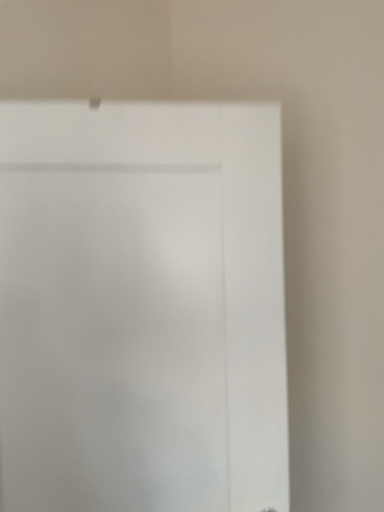
The height and width of the screenshot is (512, 384). What are the coordinates of `white matte door at center` in the screenshot? It's located at (142, 308).

In order to face white matte door at center, should I rotate leftwards or rightwards?

A 6.688 degree turn to the left will do.

The image size is (384, 512). What do you see at coordinates (142, 308) in the screenshot? I see `white matte door at center` at bounding box center [142, 308].

At what (x,y) coordinates should I click in order to perform the action: click on white matte door at center. Please return your answer as a coordinate pair (x, y). This screenshot has height=512, width=384. Looking at the image, I should click on coord(142,308).